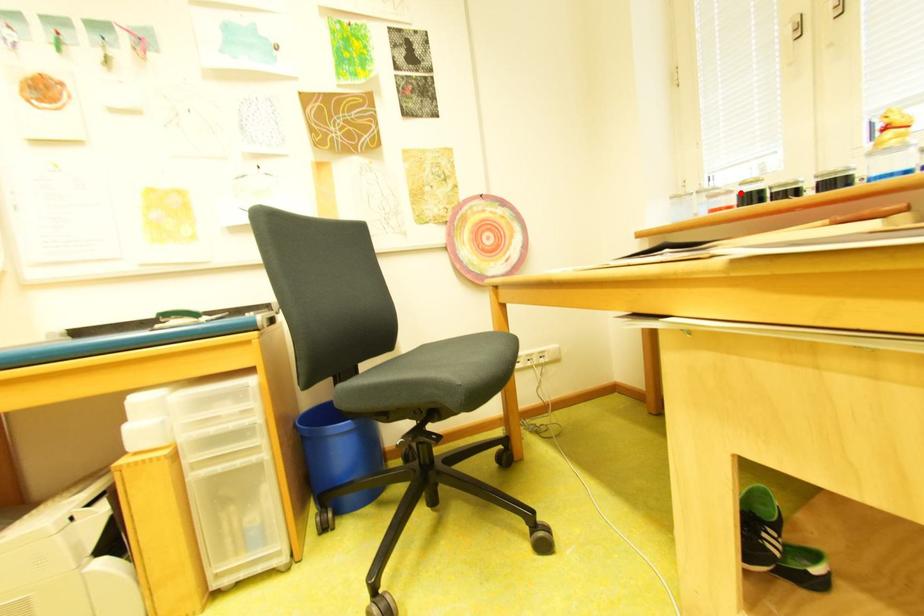
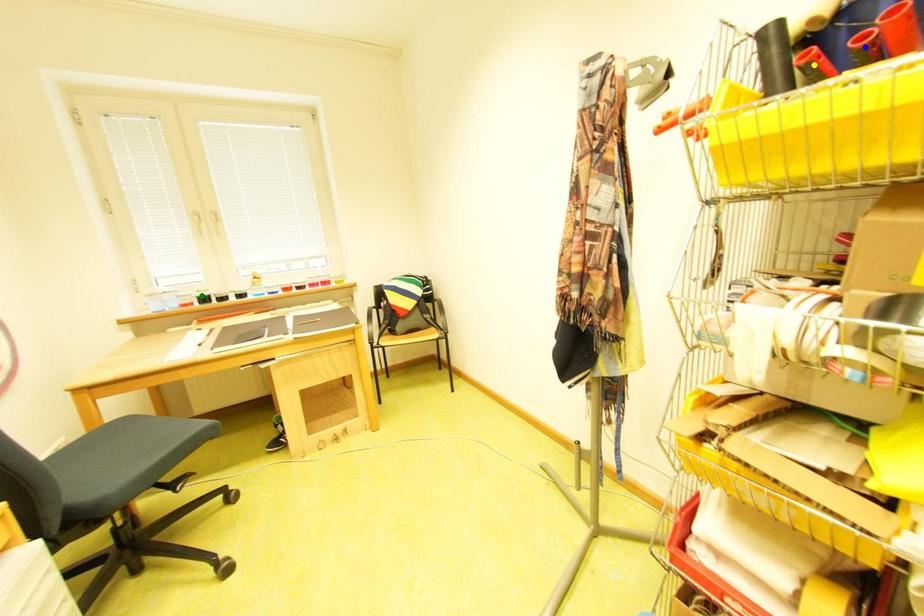
Question: I am providing you with two images of the same scene from different viewpoints. A red point is marked on the first image. You are given multiple points on the second image. In image 2, which mark is for the same physical point as the one in image 1?

Choices:
 (A) yellow point
 (B) blue point
 (C) green point

Answer: (C)